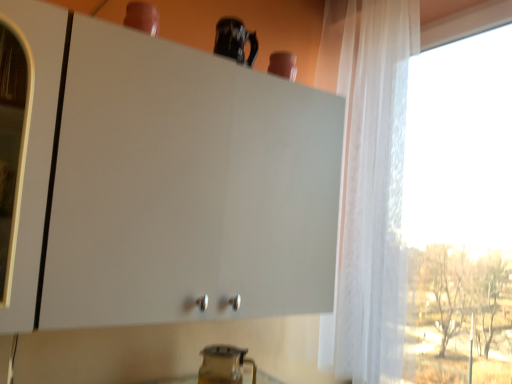
Question: From a real-world perspective, does transparent glass pitcher at lower center, the 2th appliance in the top-to-bottom sequence, sit lower than white matte cabinet at upper center?

Choices:
 (A) no
 (B) yes

Answer: (B)

Question: From a real-world perspective, is transparent glass pitcher at lower center, the 2th appliance in the top-to-bottom sequence, positioned over white matte cabinet at upper center based on gravity?

Choices:
 (A) yes
 (B) no

Answer: (B)

Question: Is transparent glass pitcher at lower center, which appears as the 1th appliance when viewed from the back, thinner than white matte cabinet at upper center?

Choices:
 (A) no
 (B) yes

Answer: (B)

Question: Can you confirm if transparent glass pitcher at lower center, the first appliance in the bottom-to-top sequence, is taller than white matte cabinet at upper center?

Choices:
 (A) no
 (B) yes

Answer: (A)

Question: Does transparent glass pitcher at lower center, which appears as the 1th appliance when viewed from the back, come behind white matte cabinet at upper center?

Choices:
 (A) yes
 (B) no

Answer: (A)

Question: Is transparent glass pitcher at lower center, the 2th appliance when ordered from front to back, touching white matte cabinet at upper center?

Choices:
 (A) yes
 (B) no

Answer: (B)

Question: Is transparent glass pitcher at lower center, which appears as the 1th appliance when viewed from the back, at the left side of glossy ceramic mug at upper center, the 2th appliance from the back?

Choices:
 (A) yes
 (B) no

Answer: (A)

Question: Does transparent glass pitcher at lower center, the first appliance in the bottom-to-top sequence, have a lesser height compared to glossy ceramic mug at upper center, the 1th appliance viewed from the front?

Choices:
 (A) yes
 (B) no

Answer: (B)

Question: From the image's perspective, is transparent glass pitcher at lower center, which appears as the 1th appliance when viewed from the back, beneath glossy ceramic mug at upper center, positioned as the 2th appliance in bottom-to-top order?

Choices:
 (A) no
 (B) yes

Answer: (B)

Question: Considering the relative sizes of transparent glass pitcher at lower center, the first appliance in the bottom-to-top sequence, and glossy ceramic mug at upper center, the 2th appliance from the back, in the image provided, is transparent glass pitcher at lower center, the first appliance in the bottom-to-top sequence, smaller than glossy ceramic mug at upper center, the 2th appliance from the back,?

Choices:
 (A) yes
 (B) no

Answer: (B)

Question: Can you confirm if transparent glass pitcher at lower center, the 2th appliance in the top-to-bottom sequence, is thinner than glossy ceramic mug at upper center, the 1th appliance viewed from the front?

Choices:
 (A) yes
 (B) no

Answer: (B)

Question: From a real-world perspective, is transparent glass pitcher at lower center, the 2th appliance when ordered from front to back, positioned under glossy ceramic mug at upper center, the 2th appliance from the back, based on gravity?

Choices:
 (A) yes
 (B) no

Answer: (A)

Question: Can you confirm if white matte cabinet at upper center is shorter than transparent glass pitcher at lower center, the 2th appliance in the top-to-bottom sequence?

Choices:
 (A) no
 (B) yes

Answer: (A)